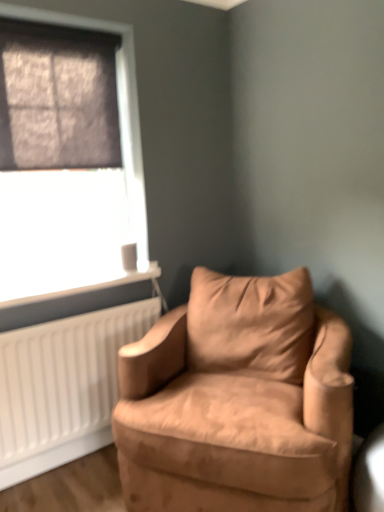
Question: From the image's perspective, is suede-like tan armchair at center over matte black window at upper left?

Choices:
 (A) no
 (B) yes

Answer: (A)

Question: Is suede-like tan armchair at center shorter than matte black window at upper left?

Choices:
 (A) no
 (B) yes

Answer: (B)

Question: Does suede-like tan armchair at center have a greater height compared to matte black window at upper left?

Choices:
 (A) no
 (B) yes

Answer: (A)

Question: Is matte black window at upper left at the back of suede-like tan armchair at center?

Choices:
 (A) yes
 (B) no

Answer: (B)

Question: Can you confirm if suede-like tan armchair at center is positioned to the left of matte black window at upper left?

Choices:
 (A) no
 (B) yes

Answer: (A)

Question: From a real-world perspective, is suede-like tan armchair at center on top of matte black window at upper left?

Choices:
 (A) yes
 (B) no

Answer: (B)

Question: Does matte black window at upper left have a smaller size compared to suede-like tan armchair at center?

Choices:
 (A) yes
 (B) no

Answer: (A)

Question: From a real-world perspective, is matte black window at upper left under suede-like tan armchair at center?

Choices:
 (A) yes
 (B) no

Answer: (B)

Question: Does matte black window at upper left lie in front of suede-like tan armchair at center?

Choices:
 (A) no
 (B) yes

Answer: (A)

Question: Is matte black window at upper left oriented away from suede-like tan armchair at center?

Choices:
 (A) no
 (B) yes

Answer: (A)

Question: Can you confirm if matte black window at upper left is bigger than suede-like tan armchair at center?

Choices:
 (A) no
 (B) yes

Answer: (A)

Question: Are matte black window at upper left and suede-like tan armchair at center making contact?

Choices:
 (A) no
 (B) yes

Answer: (A)

Question: From a real-world perspective, does matte black window at upper left sit lower than white plastic radiator at lower left?

Choices:
 (A) no
 (B) yes

Answer: (A)